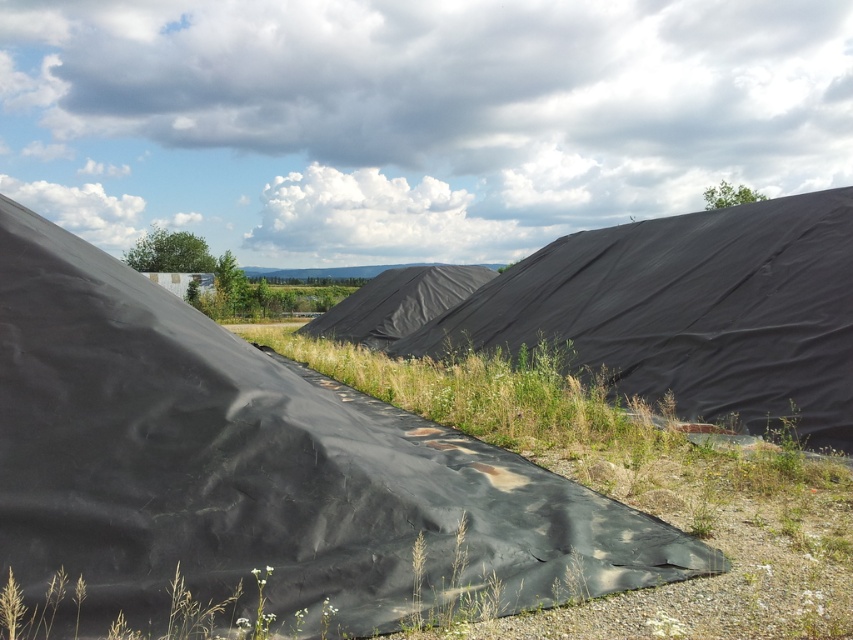
Question: Which point is closer to the camera taking this photo?

Choices:
 (A) click(706, 509)
 (B) click(757, 284)

Answer: (A)

Question: From the image, what is the correct spatial relationship of black matte tarp at center in relation to black tarp at center?

Choices:
 (A) below
 (B) above

Answer: (A)

Question: Where is green matte grass at center located in relation to black tarp at center in the image?

Choices:
 (A) below
 (B) above

Answer: (A)

Question: Does black tarp at center appear on the left side of black matte tent at center?

Choices:
 (A) no
 (B) yes

Answer: (A)

Question: Which of the following is the closest to the observer?

Choices:
 (A) black tarp at center
 (B) green matte grass at center
 (C) black matte tent at center

Answer: (B)

Question: Which object appears closest to the camera in this image?

Choices:
 (A) black matte tent at center
 (B) green matte grass at center
 (C) black tarp at center
 (D) black matte tarp at center

Answer: (D)